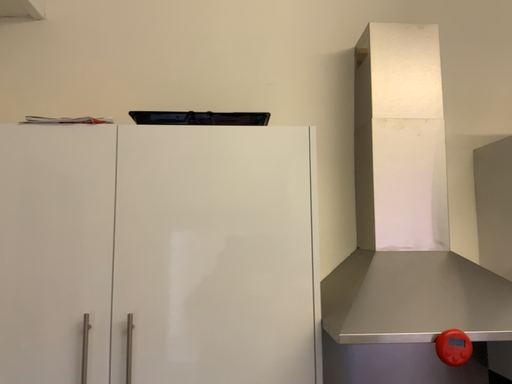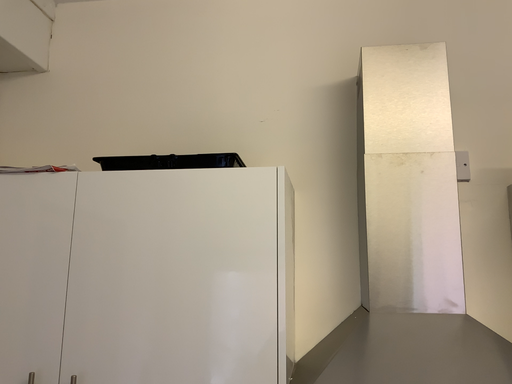
Question: Which way did the camera rotate in the video?

Choices:
 (A) rotated right
 (B) rotated left

Answer: (B)